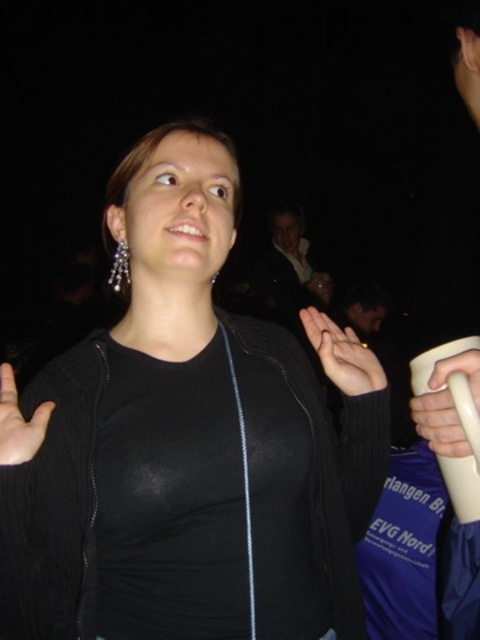
Question: Among these objects, which one is nearest to the camera?

Choices:
 (A) matte black hand at center
 (B) smooth skin palm at lower left

Answer: (B)

Question: Which point is closer to the camera taking this photo?

Choices:
 (A) (x=478, y=413)
 (B) (x=10, y=401)
 (C) (x=180, y=156)
 (D) (x=340, y=339)

Answer: (A)

Question: Is black matte jacket at center to the left of white matte cup at right from the viewer's perspective?

Choices:
 (A) yes
 (B) no

Answer: (A)

Question: Is white matte cup at right bigger than matte black hand at center?

Choices:
 (A) no
 (B) yes

Answer: (A)

Question: Which object is positioned closest to the black matte jacket at center?

Choices:
 (A) matte black hand at center
 (B) smooth skin palm at lower left

Answer: (B)

Question: Is black matte jacket at center closer to camera compared to matte black hand at center?

Choices:
 (A) no
 (B) yes

Answer: (B)